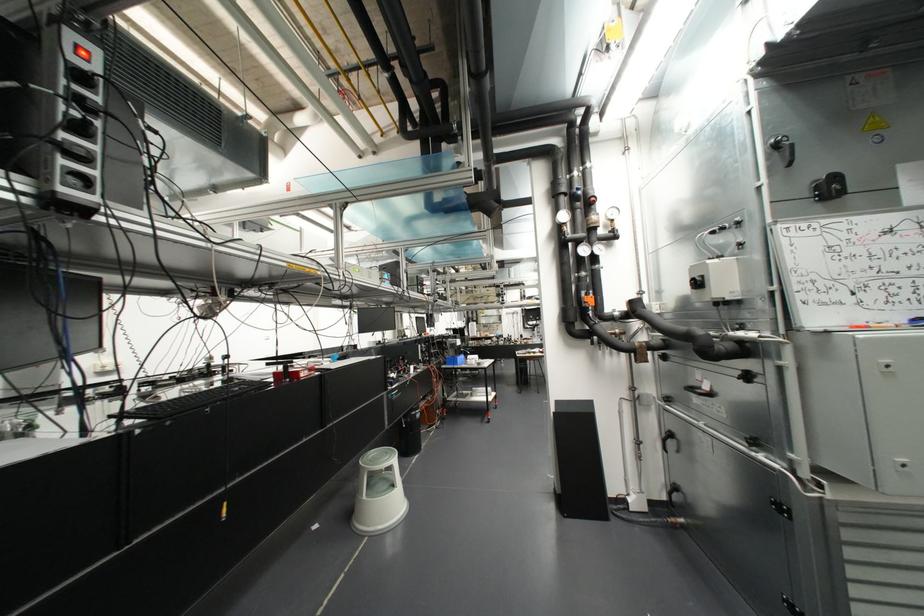
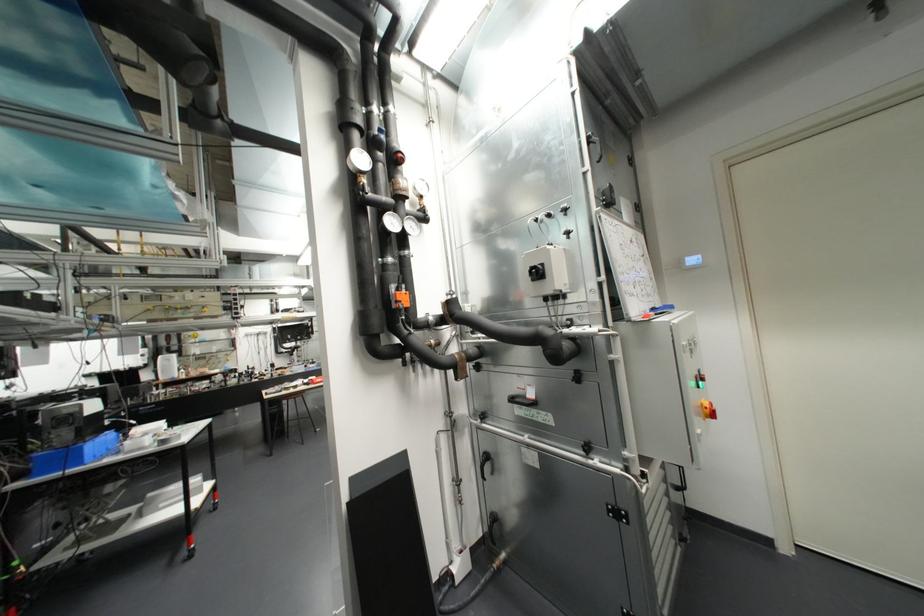
Locate, in the second image, the point that corresponds to point (455, 361) in the first image.

(71, 459)